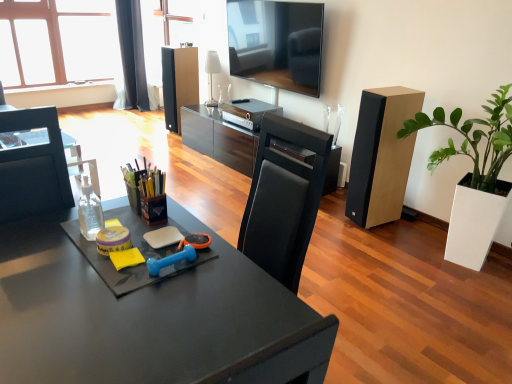
I want to click on free space to the right of clear plastic bottle at left, so click(x=146, y=233).